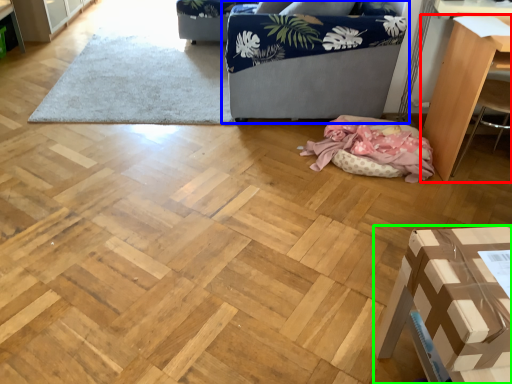
Question: Which object is the farthest from furniture (highlighted by a red box)? Choose among these: studio couch (highlighted by a blue box) or furniture (highlighted by a green box).

Choices:
 (A) studio couch
 (B) furniture

Answer: (B)